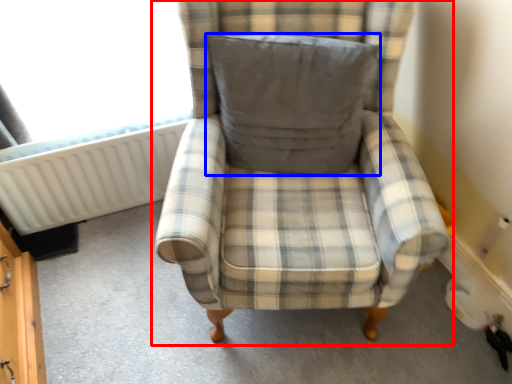
Question: Which of the following is the closest to the observer, chair (highlighted by a red box) or pillow (highlighted by a blue box)?

Choices:
 (A) chair
 (B) pillow

Answer: (A)